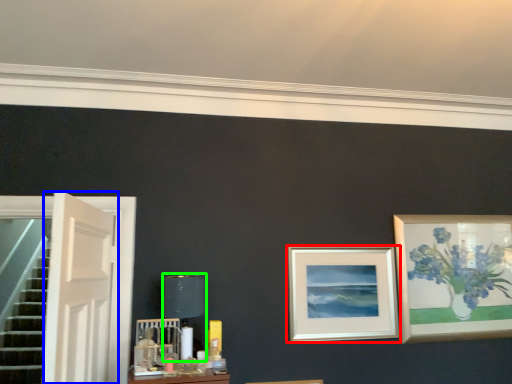
Question: Which is nearer to the picture frame (highlighted by a red box)? door (highlighted by a blue box) or table lamp (highlighted by a green box).

Choices:
 (A) door
 (B) table lamp

Answer: (B)